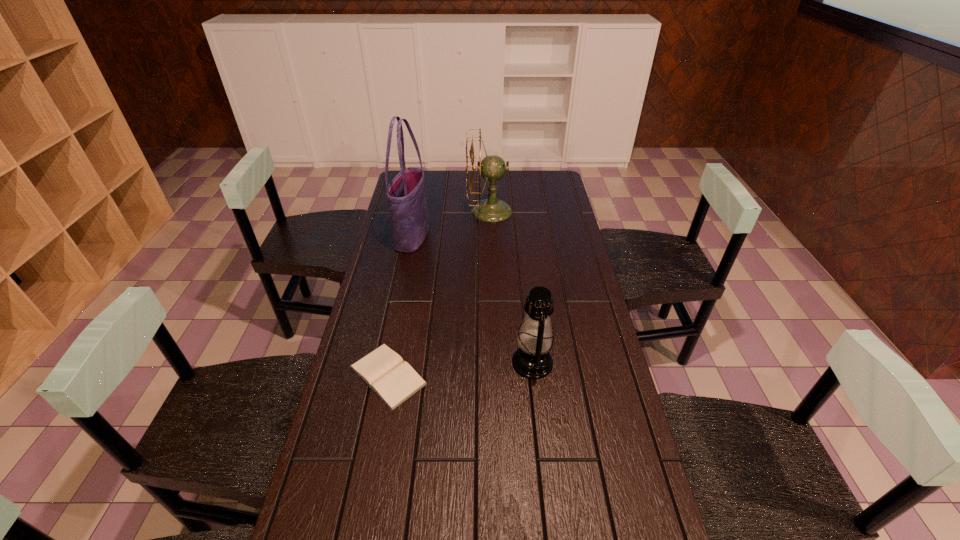
Locate an element on the screen. The width and height of the screenshot is (960, 540). the tallest object is located at coordinates (405, 194).

Find the location of a particular element. fan is located at coordinates (492, 168).

Locate an element on the screen. The height and width of the screenshot is (540, 960). oil lamp is located at coordinates (532, 360).

Find the location of a particular element. Bible is located at coordinates (383, 370).

Identify the location of vacant space positioned 0.360m on the front of the tote bag. The height and width of the screenshot is (540, 960). (396, 324).

This screenshot has width=960, height=540. Find the location of `blank space located in front of the third shortest object, directing air flow`. blank space located in front of the third shortest object, directing air flow is located at coordinates (431, 211).

Where is `vacant space located in front of the third shortest object, directing air flow`? vacant space located in front of the third shortest object, directing air flow is located at coordinates (449, 211).

At what (x,y) coordinates should I click in order to perform the action: click on vacant position located 0.120m in front of the third shortest object, directing air flow. Please return your answer as a coordinate pair (x, y). Looking at the image, I should click on (440, 211).

Find the location of a particular element. This screenshot has width=960, height=540. vacant area located 0.300m on the left of the third tallest object is located at coordinates (411, 362).

The image size is (960, 540). Find the location of `blank space located on the back of the shortest object`. blank space located on the back of the shortest object is located at coordinates (406, 280).